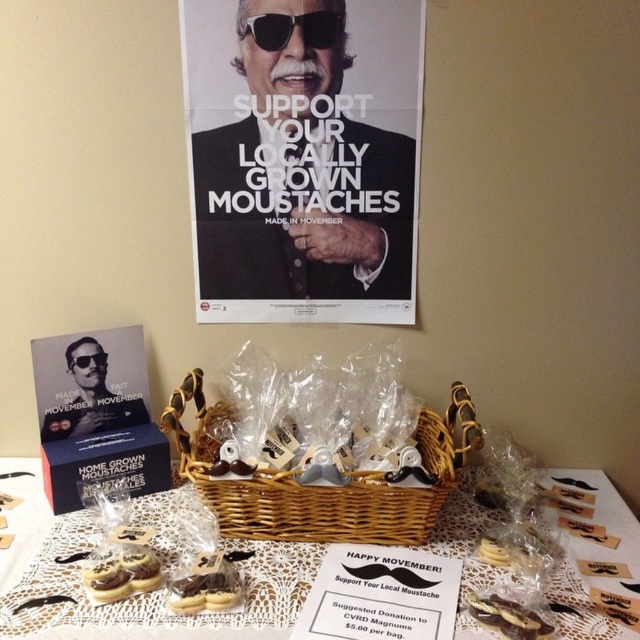
What is located at the point with coordinates (300, 172) in the image?

The point at coordinates (300, 172) is occupied by a matte black suit at upper center.

You are a photographer taking a picture of the table setup for the Movember campaign. You notice two points of interest marked as point 1 at coordinates point 1 at point (305,268) and point 2 at point (64,339). Which point is closer to your camera lens?

Point 1 at point (305,268) is further to the camera than point 2 at point (64,339), so point 2 is closer to the camera lens.

You are a photographer standing at the camera position. You want to take a closeup shot of the matte black suit at upper center. What is the minimum distance you need to move forward to focus on it?

The matte black suit at upper center is 38.36 inches away from the camera. To focus on it, you need to move forward until you are within the minimum focusing distance of your camera lens, but since the object is already 38.36 inches away, if your lens can focus at that distance, you don